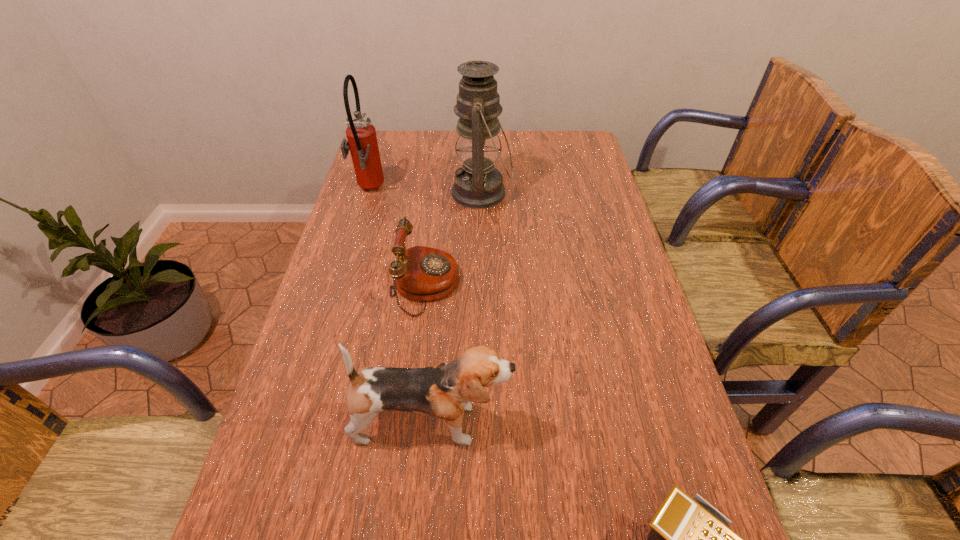
Image resolution: width=960 pixels, height=540 pixels. What are the coordinates of `free space that satisfies the following two spatial constraints: 1. at the nozzle of the oil lamp; 2. on the left side of the fire extinguisher` in the screenshot? It's located at (368, 193).